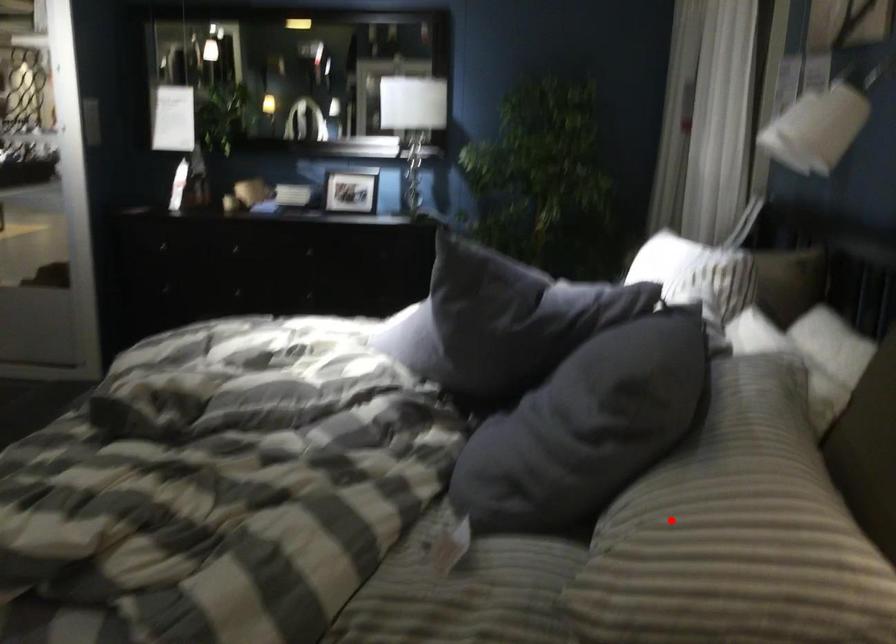
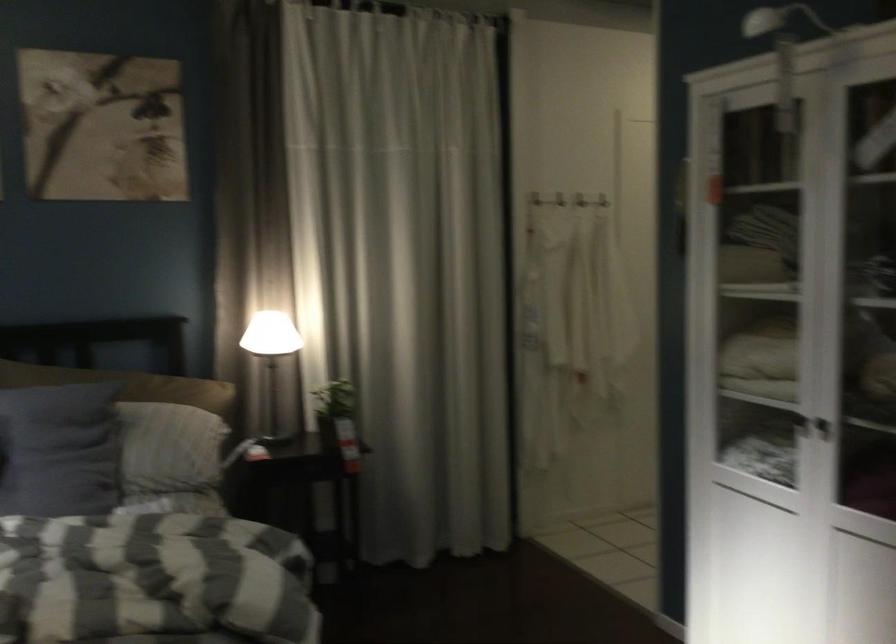
Locate, in the second image, the point that corresponds to the highlighted location in the first image.

(173, 442)